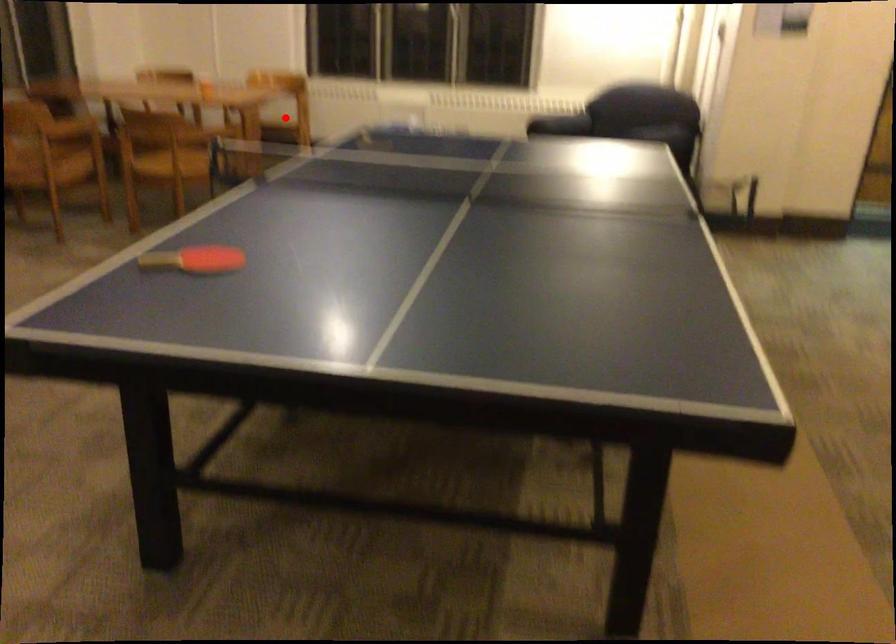
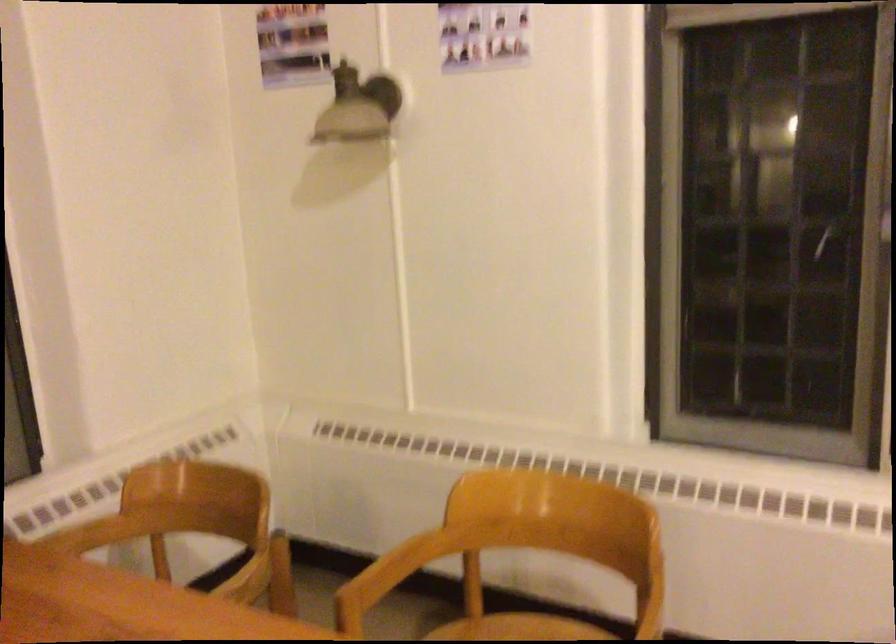
In the second image, find the point that corresponds to the highlighted location in the first image.

(517, 629)